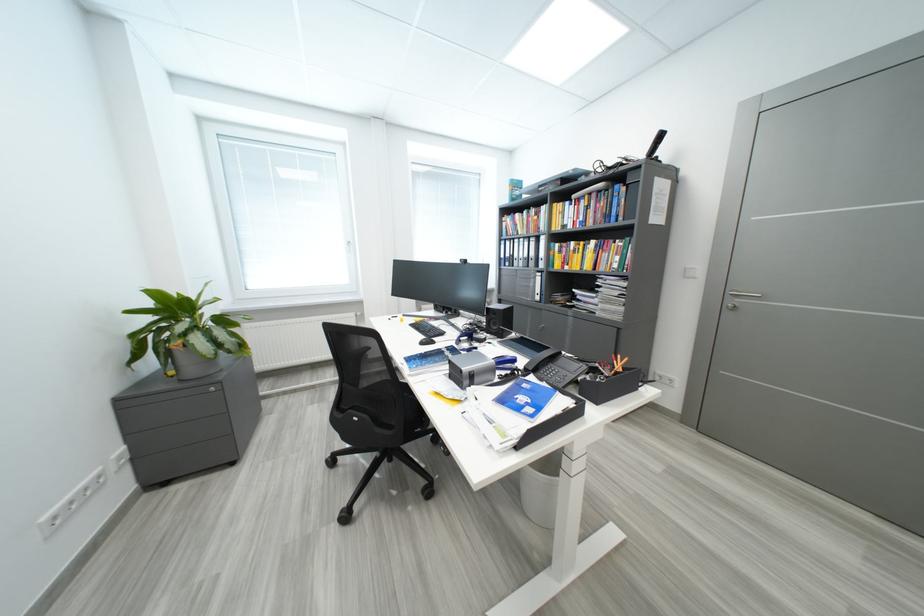
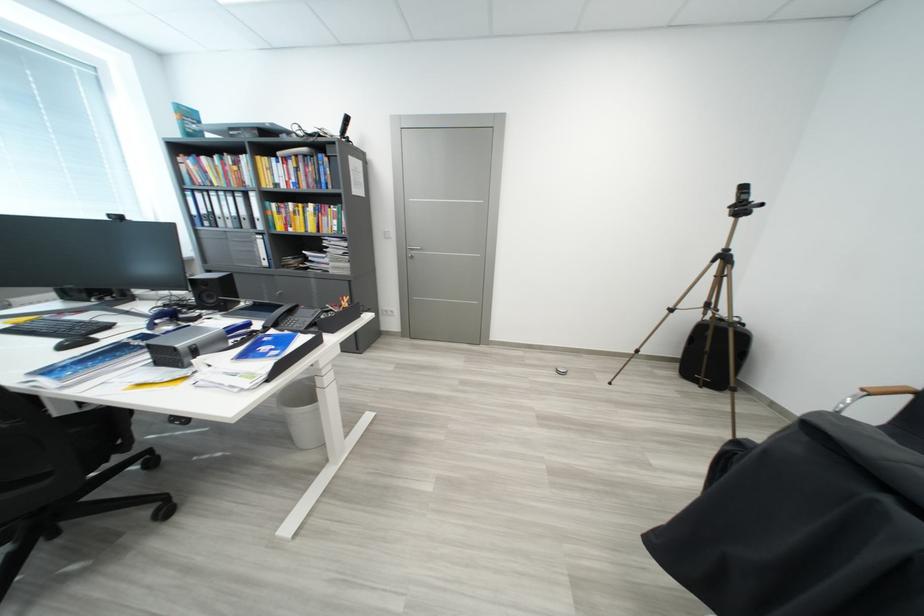
The point at [535,371] is marked in the first image. Where is the corresponding point in the second image?

(274, 330)